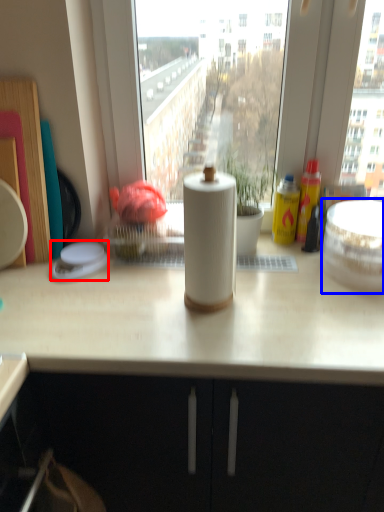
Question: Which point is closer to the camera, appliance (highlighted by a red box) or appliance (highlighted by a blue box)?

Choices:
 (A) appliance
 (B) appliance

Answer: (B)